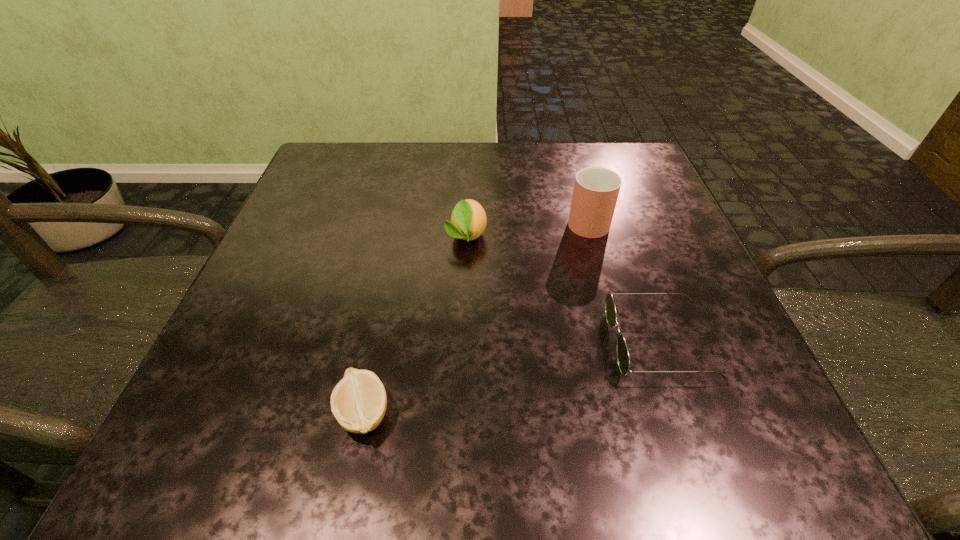
The image size is (960, 540). In order to click on the tallest object in this screenshot , I will do `click(596, 189)`.

What are the coordinates of `the right lemon` in the screenshot? It's located at (468, 220).

Identify the location of the third object from right to left. The height and width of the screenshot is (540, 960). (468, 220).

You are a GUI agent. You are given a task and a screenshot of the screen. Output one action in this format:
    pyautogui.click(x=<x>, y=<y>)
    Task: Click on the sunglasses
    The image size is (960, 540).
    Given the screenshot: What is the action you would take?
    pyautogui.click(x=623, y=358)

Where is `the shorter lemon`? The width and height of the screenshot is (960, 540). the shorter lemon is located at coordinates (358, 402).

Locate an element on the screen. the left lemon is located at coordinates (358, 402).

Where is `vacant area situated on the side of the cup with the handle`? Image resolution: width=960 pixels, height=540 pixels. vacant area situated on the side of the cup with the handle is located at coordinates click(566, 144).

Find the location of a particular element. vacant space located on the side of the cup with the handle is located at coordinates (570, 157).

Where is `vacant space located 0.180m on the side of the cup with the handle`? vacant space located 0.180m on the side of the cup with the handle is located at coordinates (570, 157).

This screenshot has width=960, height=540. Find the location of `vacant space located 0.230m with leaves positioned above the third shortest object`. vacant space located 0.230m with leaves positioned above the third shortest object is located at coordinates (462, 362).